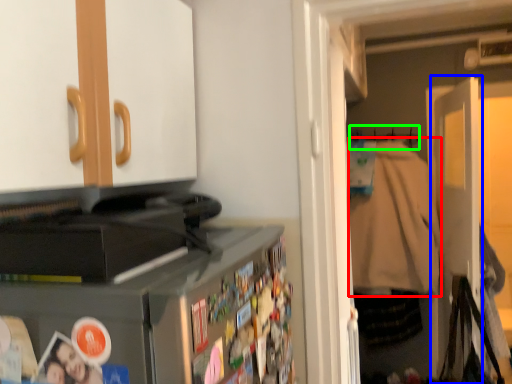
Question: Which is nearer to the jacket (highlighted by a red box)? door (highlighted by a blue box) or hanger (highlighted by a green box).

Choices:
 (A) door
 (B) hanger

Answer: (A)